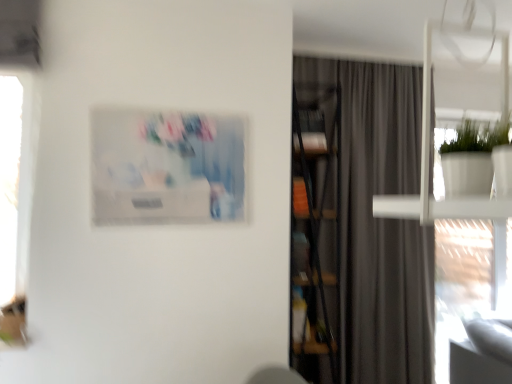
Measure the distance between point [324,115] and camera.

Point [324,115] and camera are 9.63 feet apart from each other.

What are the coordinates of `gray matte curtain at center` in the screenshot? It's located at (381, 223).

You are a GUI agent. You are given a task and a screenshot of the screen. Output one action in this format:
    pyautogui.click(x=<x>, y=<y>)
    Task: Click on the wooden bookcase at center
    Image resolution: width=512 pixels, height=384 pixels.
    Given the screenshot: What is the action you would take?
    pyautogui.click(x=315, y=230)

Relative to gray matte curtain at center, is wooden bookcase at center in front or behind?

wooden bookcase at center is positioned closer to the viewer than gray matte curtain at center.

From a real-world perspective, does wooden bookcase at center stand above gray matte curtain at center?

No.

Consider the image. How many degrees apart are the facing directions of wooden bookcase at center and gray matte curtain at center?

The angular difference between wooden bookcase at center and gray matte curtain at center is 88.7 degrees.

In the scene shown: How distant is wooden bookcase at center from gray matte curtain at center?

wooden bookcase at center and gray matte curtain at center are 13.39 inches apart.

Is gray matte curtain at center not close to matte plastic picture frame at upper center?

That's right, there is a large distance between gray matte curtain at center and matte plastic picture frame at upper center.

From the image's perspective, is gray matte curtain at center above or below matte plastic picture frame at upper center?

From the image's perspective, gray matte curtain at center appears below matte plastic picture frame at upper center.

Is gray matte curtain at center bigger or smaller than matte plastic picture frame at upper center?

gray matte curtain at center is bigger than matte plastic picture frame at upper center.

Is gray matte curtain at center turned away from matte plastic picture frame at upper center?

gray matte curtain at center does not have its back to matte plastic picture frame at upper center.

Find the location of a particular element. The image size is (512, 384). curtain that is on the right side of matte plastic picture frame at upper center is located at coordinates (381, 223).

Based on the photo, considering the relative sizes of matte plastic picture frame at upper center and gray matte curtain at center in the image provided, is matte plastic picture frame at upper center thinner than gray matte curtain at center?

Yes, matte plastic picture frame at upper center is thinner than gray matte curtain at center.

Which object is more forward, gray matte curtain at center or wooden bookcase at center?

Positioned in front is wooden bookcase at center.

Identify the location of curtain above the wooden bookcase at center (from the image's perspective). pyautogui.click(x=381, y=223).

From the image's perspective, is gray matte curtain at center located above or below wooden bookcase at center?

gray matte curtain at center is above wooden bookcase at center.

Considering the relative positions of matte plastic picture frame at upper center and wooden bookcase at center in the image provided, is matte plastic picture frame at upper center to the left of wooden bookcase at center from the viewer's perspective?

Yes, matte plastic picture frame at upper center is to the left of wooden bookcase at center.

Based on the photo, is matte plastic picture frame at upper center in front of wooden bookcase at center?

Yes, it is in front of wooden bookcase at center.

From the image's perspective, is matte plastic picture frame at upper center beneath wooden bookcase at center?

Incorrect, from the image's perspective, matte plastic picture frame at upper center is higher than wooden bookcase at center.

The image size is (512, 384). What are the coordinates of `bookcase behind the matte plastic picture frame at upper center` in the screenshot? It's located at (315, 230).

In the scene shown: Considering the sizes of objects wooden bookcase at center and matte plastic picture frame at upper center in the image provided, who is shorter, wooden bookcase at center or matte plastic picture frame at upper center?

matte plastic picture frame at upper center is shorter.

Considering the positions of point (295, 174) and point (156, 211), is point (295, 174) closer or farther from the camera than point (156, 211)?

Clearly, point (295, 174) is more distant from the camera than point (156, 211).

Which is behind, wooden bookcase at center or matte plastic picture frame at upper center?

wooden bookcase at center is further away from the camera.

Is wooden bookcase at center facing towards matte plastic picture frame at upper center?

No, wooden bookcase at center is not facing towards matte plastic picture frame at upper center.

The height and width of the screenshot is (384, 512). I want to click on bookcase that appears on the left of gray matte curtain at center, so click(315, 230).

Where is `picture frame above the gray matte curtain at center (from the image's perspective)`? This screenshot has height=384, width=512. picture frame above the gray matte curtain at center (from the image's perspective) is located at coordinates (166, 167).

Based on their spatial positions, is wooden bookcase at center or gray matte curtain at center further from matte plastic picture frame at upper center?

Among the two, gray matte curtain at center is located further to matte plastic picture frame at upper center.

When comparing their distances from gray matte curtain at center, does matte plastic picture frame at upper center or wooden bookcase at center seem further?

matte plastic picture frame at upper center is further to gray matte curtain at center.

From the picture: Considering their positions, is wooden bookcase at center positioned further to gray matte curtain at center than matte plastic picture frame at upper center?

The object further to gray matte curtain at center is matte plastic picture frame at upper center.

From the image, which object appears to be farther from wooden bookcase at center, matte plastic picture frame at upper center or gray matte curtain at center?

Based on the image, matte plastic picture frame at upper center appears to be further to wooden bookcase at center.

Estimate the real-world distances between objects in this image. Which object is closer to wooden bookcase at center, gray matte curtain at center or matte plastic picture frame at upper center?

gray matte curtain at center.

Considering their positions, is gray matte curtain at center positioned further to matte plastic picture frame at upper center than wooden bookcase at center?

Based on the image, gray matte curtain at center appears to be further to matte plastic picture frame at upper center.

In order to click on bookcase between matte plastic picture frame at upper center and gray matte curtain at center from left to right in this screenshot , I will do point(315,230).